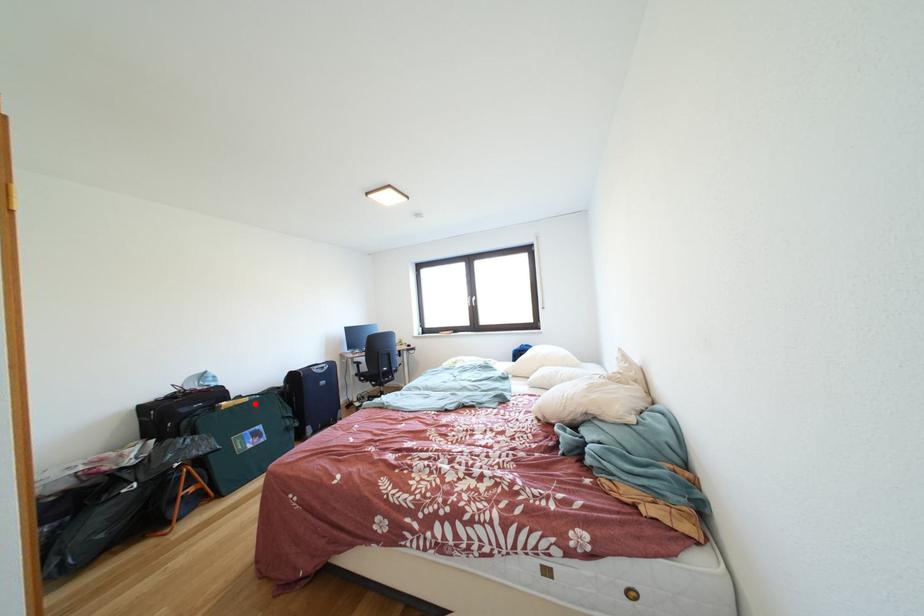
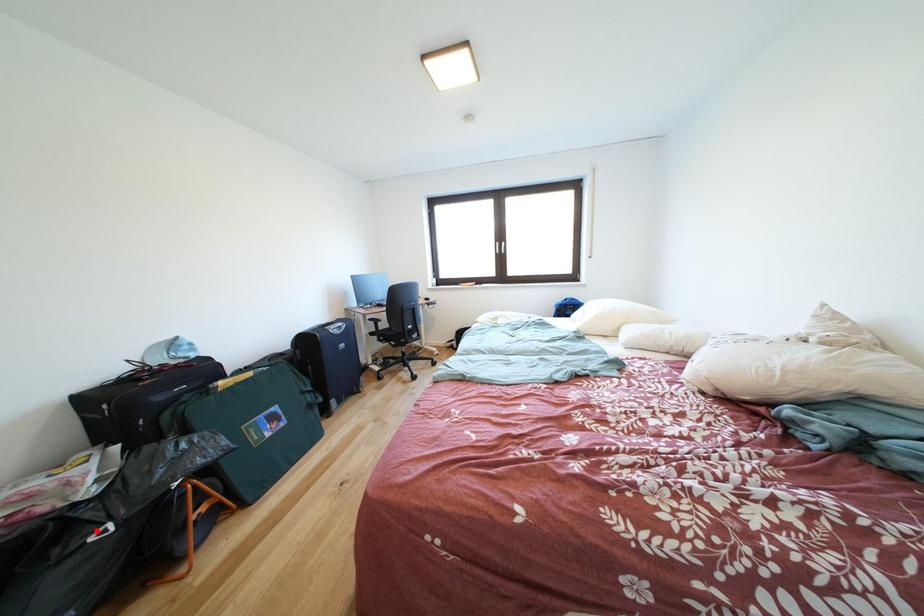
I am providing you with two images of the same scene from different viewpoints. A red point is marked on the first image and another point is marked on the second image. Do the highlighted points in image1 and image2 indicate the same real-world spot?

No